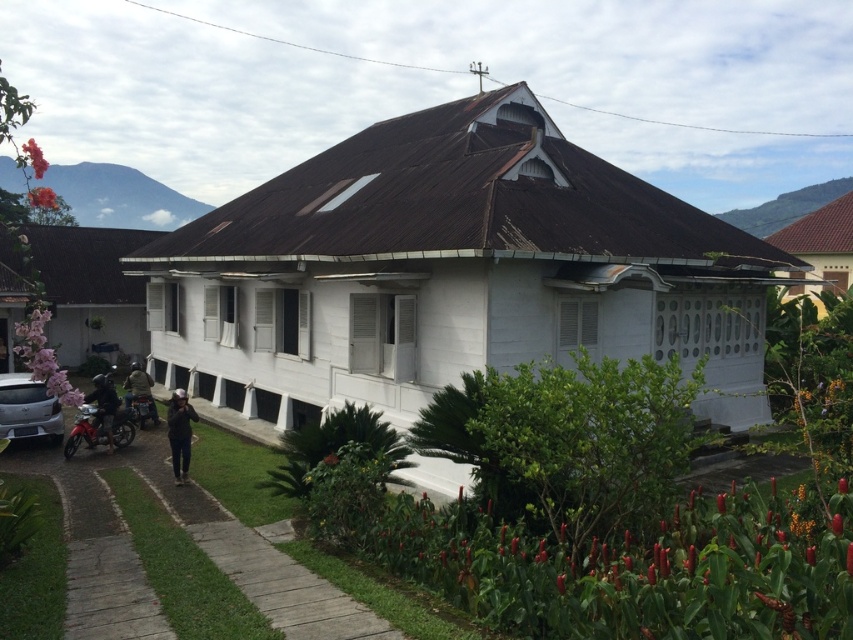
Is metallic red motorcycle at lower left below camouflage jacket at lower left?

Correct, metallic red motorcycle at lower left is located below camouflage jacket at lower left.

From the picture: Is metallic red motorcycle at lower left thinner than camouflage jacket at lower left?

Correct, metallic red motorcycle at lower left's width is less than camouflage jacket at lower left's.

Who is more distant from viewer, (88,448) or (143,380)?

The point (143,380) is more distant.

The image size is (853, 640). I want to click on metallic red motorcycle at lower left, so click(86, 429).

Between point (180, 456) and point (134, 403), which one is positioned behind?

The point (134, 403) is more distant.

Does dark gray fabric at center have a lesser width compared to metallic silver motorcycle at lower left?

Indeed, dark gray fabric at center has a lesser width compared to metallic silver motorcycle at lower left.

Find the location of a particular element. The image size is (853, 640). dark gray fabric at center is located at coordinates (178, 433).

The image size is (853, 640). I want to click on dark gray fabric at center, so click(x=178, y=433).

Is point (177, 451) closer to camera compared to point (108, 420)?

Yes, point (177, 451) is closer to viewer.

Measure the distance between dark gray fabric at center and dark blue helmet at lower left.

dark gray fabric at center and dark blue helmet at lower left are 3.95 meters apart.

Between point (181, 417) and point (102, 417), which one is positioned behind?

Point (102, 417)

What are the coordinates of `dark gray fabric at center` in the screenshot? It's located at pyautogui.click(x=178, y=433).